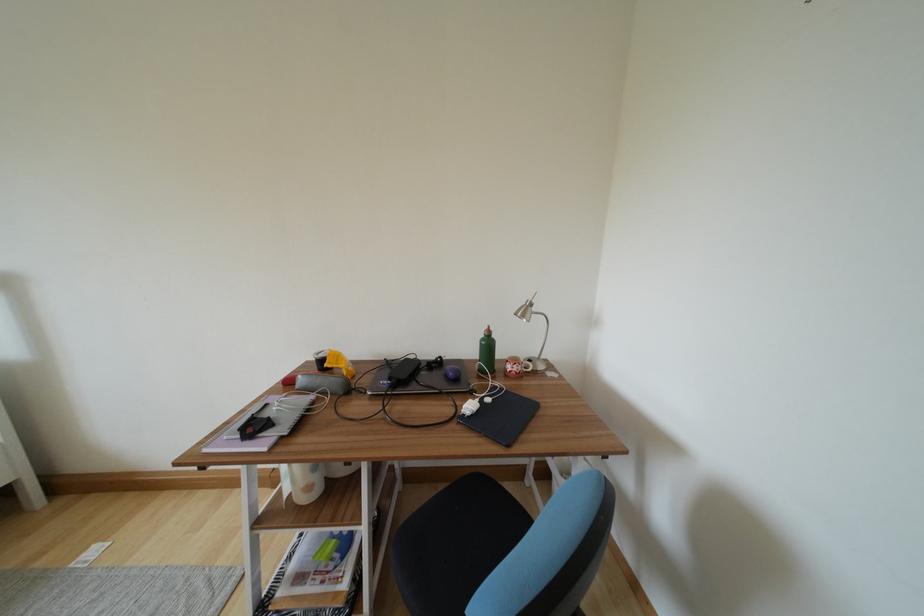
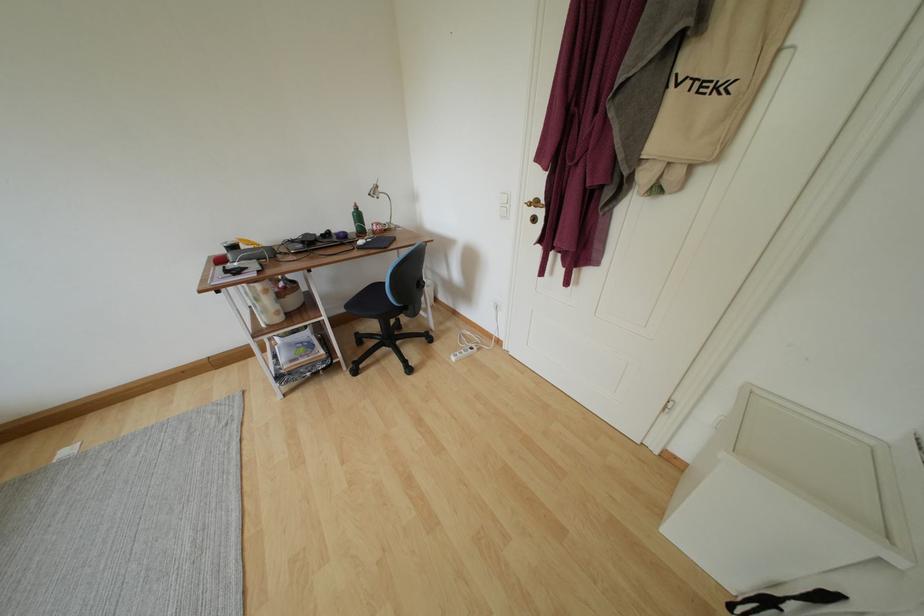
Find the pixel in the second image that matches (493,349) in the first image.

(363, 220)